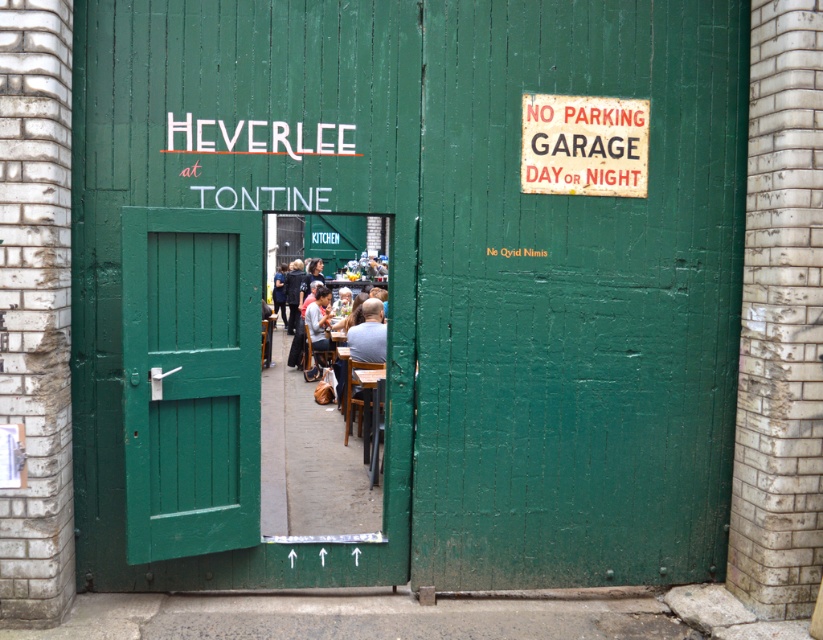
Is green wooden door at center further to the viewer compared to metallic rectangular sign at upper right?

That is False.

Find the location of a particular element. Image resolution: width=823 pixels, height=640 pixels. green wooden door at center is located at coordinates (189, 380).